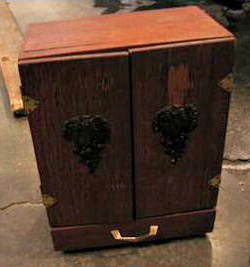
You are a GUI agent. You are given a task and a screenshot of the screen. Output one action in this format:
    pyautogui.click(x=<x>, y=<y>)
    Task: Click on the drawer
    This screenshot has height=267, width=250.
    Given the screenshot: What is the action you would take?
    pyautogui.click(x=186, y=229)